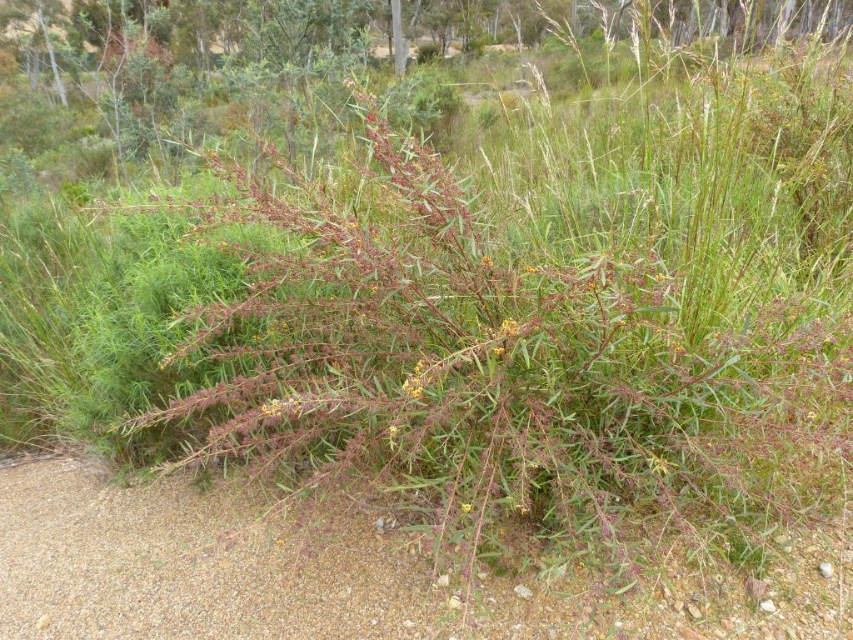
In the scene shown: You are standing at the center of the image and want to walk towards the gray gravel at lower left. Which direction should you face to head directly towards it?

To head directly towards the gray gravel at lower left from the center of the image, you should face towards the lower left direction since the gray gravel at lower left is located at point (x=326, y=577).

You are standing at the gravel path at the bottom left corner of the image. You see two points marked in the scene, point [630,596] and point [276,397]. Which point is closer to you?

Point [630,596] is closer to the camera than point [276,397], so the point closer to you is point [630,596].